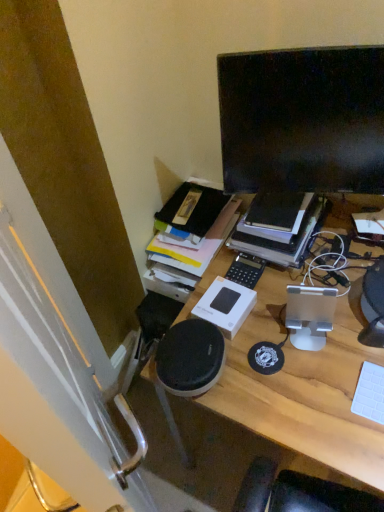
Locate an element on the screen. The image size is (384, 512). free space behind white matte keyboard at right is located at coordinates (352, 340).